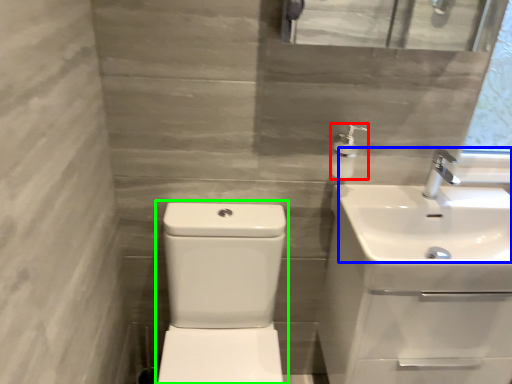
Question: Which object is the farthest from soap dispenser (highlighted by a red box)? Choose among these: sink (highlighted by a blue box) or sink (highlighted by a green box).

Choices:
 (A) sink
 (B) sink

Answer: (B)